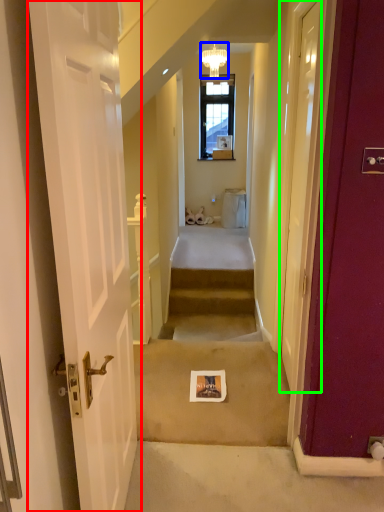
Question: Which object is positioned closest to door (highlighted by a red box)? Select from light fixture (highlighted by a blue box) and door (highlighted by a green box).

Choices:
 (A) light fixture
 (B) door

Answer: (B)